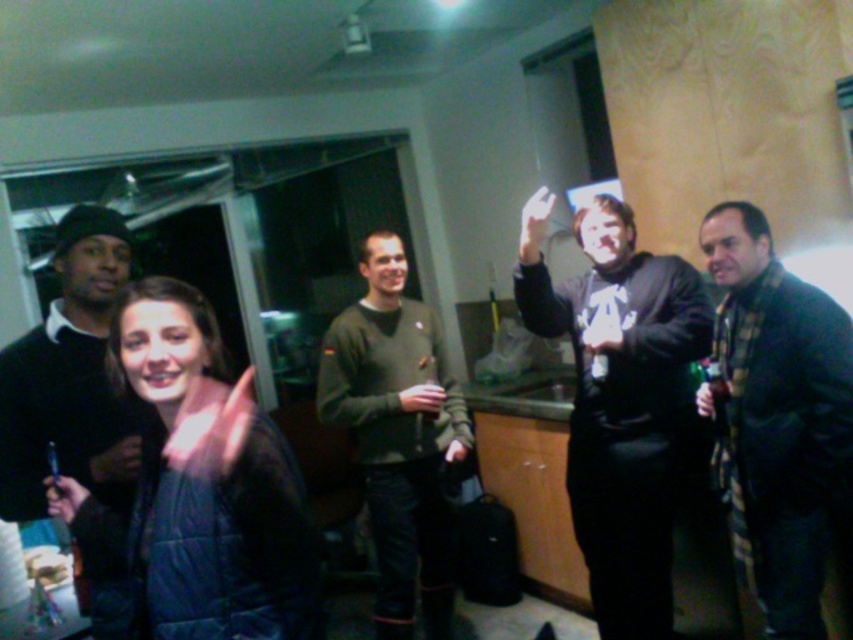
You are standing in the room and want to hand a gift to the person wearing the black matte hoodie at center without disturbing the person in the matte black sweater at left. Which direction should you move towards?

You should move towards the right side of the room because the black matte hoodie at center is to the right of the matte black sweater at left, so moving right will allow you to reach the hoodie wearer without getting close to the sweater wearer.

There are two people in the image. The first is at point (399,444) and the second is at point 0.306, 0.530. If you want to place a table between them so that both can comfortably reach it, what should be the minimum length of the table in feet?

The two people are 9.26 feet apart. To ensure both can comfortably reach the table, the minimum length should be at least half the distance between them, so approximately 4.63 feet.

You are standing in the room and want to hand a gift to the person wearing the green sweater at center without disturbing the person in the matte black sweater at left. Based on their positions, which direction should you approach from?

Since the green sweater at center is below the matte black sweater at left, you should approach from the lower side to avoid disturbing the person in the matte black sweater at left.